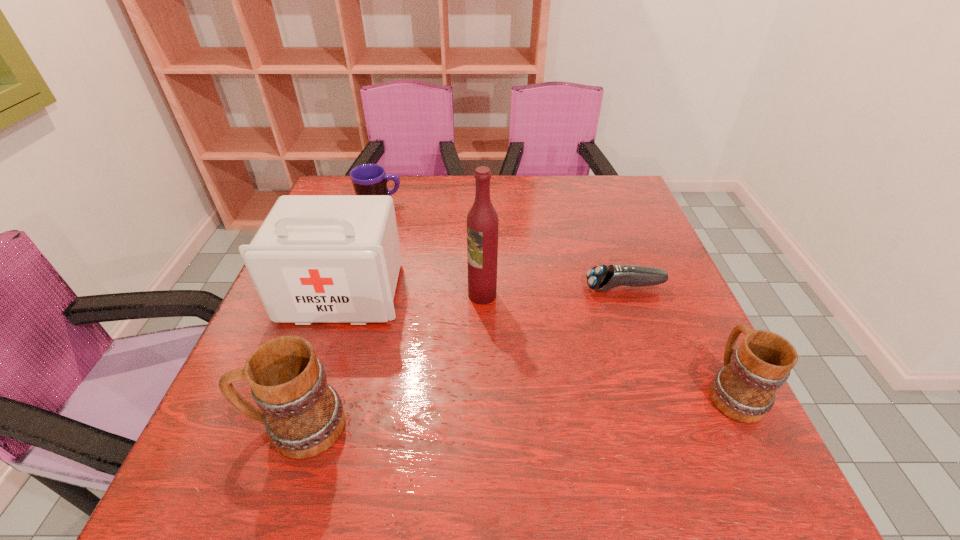
What are the coordinates of `vacant space located on the side of the rightmost mug with the handle` in the screenshot? It's located at (659, 241).

Where is `vacant region located on the side of the rightmost mug with the handle`? This screenshot has width=960, height=540. vacant region located on the side of the rightmost mug with the handle is located at coordinates tap(690, 306).

Locate an element on the screen. free space located 0.290m with the handle on the side of the farthest object is located at coordinates (501, 203).

I want to click on vacant area situated 0.090m on the front-facing side of the second tallest object, so click(x=320, y=361).

This screenshot has width=960, height=540. Identify the location of free space located 0.140m on the head of the shortest object. (525, 288).

I want to click on vacant space located on the head of the shortest object, so click(x=534, y=288).

Identify the location of free point located 0.380m on the head of the shortest object. (422, 288).

What are the coordinates of `vacant space located on the label of the liquor` in the screenshot? It's located at (307, 294).

At what (x,y) coordinates should I click in order to perform the action: click on free spot located 0.330m on the label of the liquor. Please return your answer as a coordinate pair (x, y). The width and height of the screenshot is (960, 540). Looking at the image, I should click on (324, 294).

At what (x,y) coordinates should I click in order to perform the action: click on vacant space situated on the label of the liquor. Please return your answer as a coordinate pair (x, y). This screenshot has width=960, height=540. Looking at the image, I should click on (443, 294).